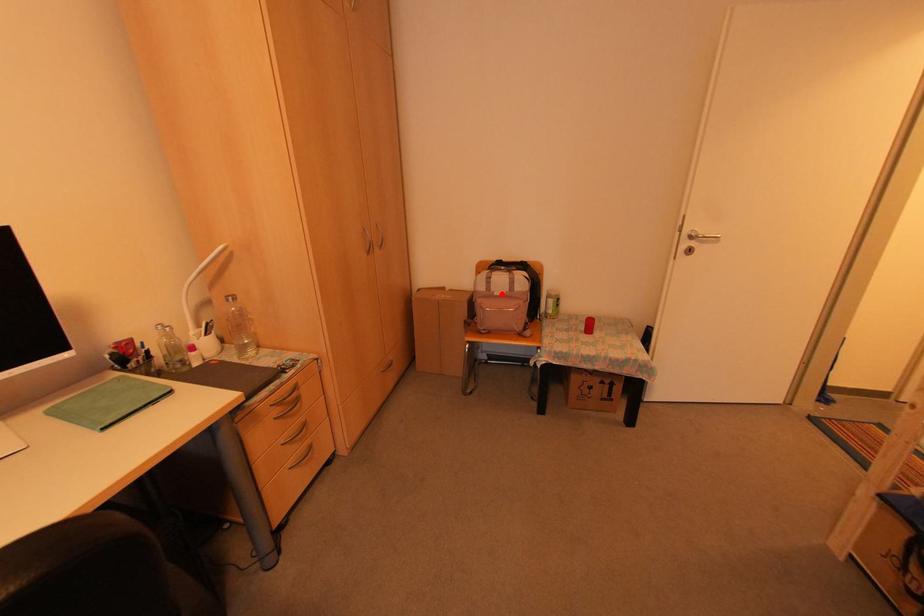
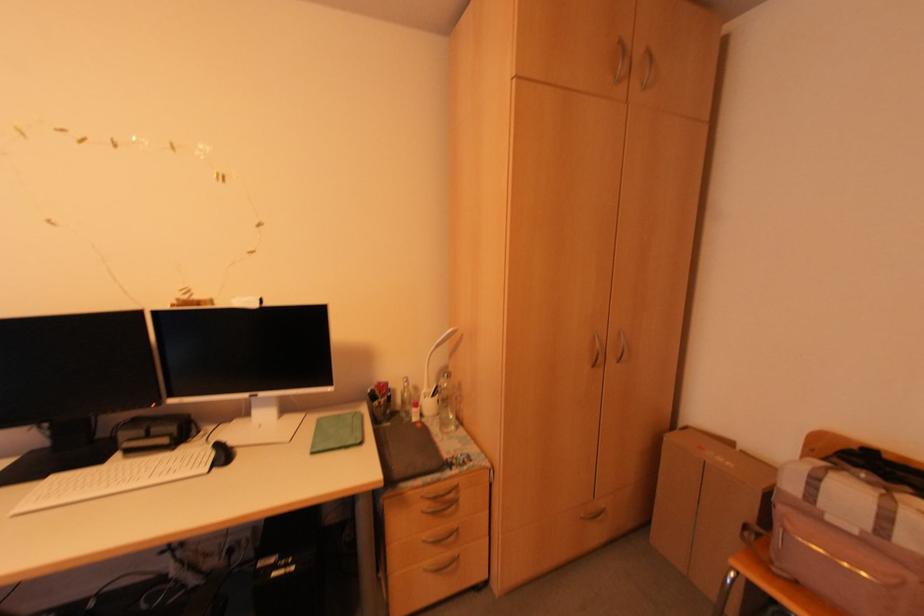
Question: I am providing you with two images of the same scene from different viewpoints. Image1 has a red point marked. In image2, the corresponding 3D location appears at what relative position? Reply with the corresponding letter.

Choices:
 (A) Closer
 (B) Farther

Answer: (A)